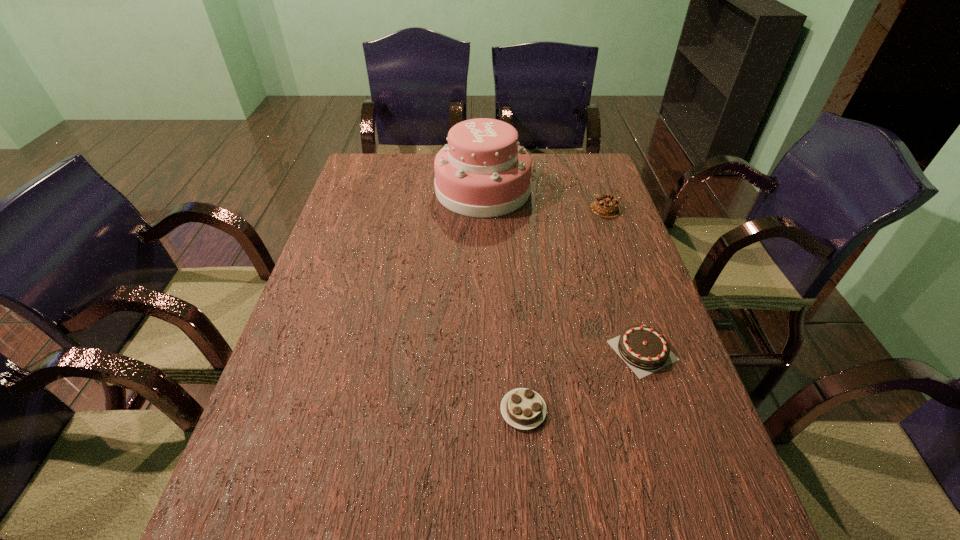
Image resolution: width=960 pixels, height=540 pixels. Find the location of `free point between the shortest object and the third farthest object`. free point between the shortest object and the third farthest object is located at coordinates (583, 380).

The image size is (960, 540). Find the location of `free space between the tallest object and the tallest chocolate cake`. free space between the tallest object and the tallest chocolate cake is located at coordinates (544, 199).

The width and height of the screenshot is (960, 540). I want to click on empty space that is in between the second shortest object and the birthday cake, so click(563, 270).

At what (x,y) coordinates should I click in order to perform the action: click on free area in between the birthday cake and the second nearest chocolate cake. Please return your answer as a coordinate pair (x, y). The height and width of the screenshot is (540, 960). Looking at the image, I should click on (563, 270).

Find the location of `empty space between the tallest chocolate cake and the tallest object`. empty space between the tallest chocolate cake and the tallest object is located at coordinates (544, 199).

Where is `free spot between the leftmost chocolate cake and the birthday cake`? Image resolution: width=960 pixels, height=540 pixels. free spot between the leftmost chocolate cake and the birthday cake is located at coordinates (503, 300).

Find the location of a particular element. vacant region between the shortest chocolate cake and the tallest chocolate cake is located at coordinates (564, 309).

Find the location of a particular element. Image resolution: width=960 pixels, height=540 pixels. the second closest object relative to the second shortest object is located at coordinates (606, 206).

Identify the location of object that ranks as the second closest to the second shortest chocolate cake. The height and width of the screenshot is (540, 960). (606, 206).

This screenshot has height=540, width=960. I want to click on chocolate cake that stands as the closest to the tallest object, so click(606, 206).